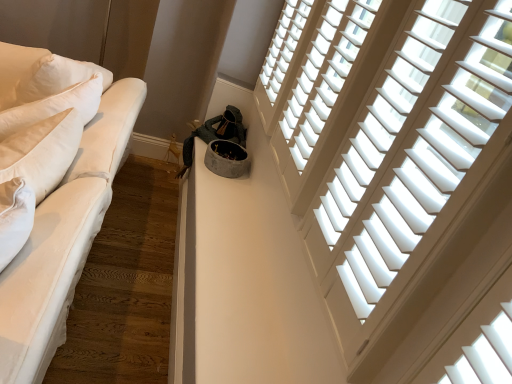
Question: Is white wood blinds at upper right, the third window in the front-to-back sequence, positioned behind white wood blinds at upper right, placed as the second window when sorted from front to back?

Choices:
 (A) no
 (B) yes

Answer: (B)

Question: Is white wood blinds at upper right, the third window in the front-to-back sequence, beside white wood blinds at upper right, placed as the second window when sorted from front to back?

Choices:
 (A) no
 (B) yes

Answer: (A)

Question: From a real-world perspective, is white wood blinds at upper right, positioned as the first window in back-to-front order, positioned over white wood blinds at upper right, placed as the second window when sorted from front to back, based on gravity?

Choices:
 (A) yes
 (B) no

Answer: (B)

Question: Is white wood blinds at upper right, positioned as the first window in back-to-front order, wider than white wood blinds at upper right, the 2th window in the back-to-front sequence?

Choices:
 (A) yes
 (B) no

Answer: (B)

Question: Is white wood blinds at upper right, the third window in the front-to-back sequence, not inside white wood blinds at upper right, the 2th window in the back-to-front sequence?

Choices:
 (A) no
 (B) yes

Answer: (B)

Question: Considering the positions of white wood blinds at upper right, marked as the first window in a front-to-back arrangement, and white wood blinds at upper right, the 2th window in the back-to-front sequence, in the image, is white wood blinds at upper right, marked as the first window in a front-to-back arrangement, wider or thinner than white wood blinds at upper right, the 2th window in the back-to-front sequence,?

Choices:
 (A) wide
 (B) thin

Answer: (A)

Question: Is point (450, 213) positioned closer to the camera than point (337, 67)?

Choices:
 (A) closer
 (B) farther

Answer: (A)

Question: Considering the positions of white wood blinds at upper right, marked as the first window in a front-to-back arrangement, and white wood blinds at upper right, the 2th window in the back-to-front sequence, in the image, is white wood blinds at upper right, marked as the first window in a front-to-back arrangement, bigger or smaller than white wood blinds at upper right, the 2th window in the back-to-front sequence,?

Choices:
 (A) big
 (B) small

Answer: (A)

Question: Is white wood blinds at upper right, arranged as the third window when viewed from the back, inside the boundaries of white wood blinds at upper right, placed as the second window when sorted from front to back, or outside?

Choices:
 (A) outside
 (B) inside

Answer: (A)

Question: Considering their positions, is white cotton studio couch at left located in front of or behind white wood blinds at upper right, marked as the first window in a front-to-back arrangement?

Choices:
 (A) front
 (B) behind

Answer: (A)

Question: From the image's perspective, is white cotton studio couch at left above or below white wood blinds at upper right, arranged as the third window when viewed from the back?

Choices:
 (A) below
 (B) above

Answer: (A)

Question: In terms of width, does white cotton studio couch at left look wider or thinner when compared to white wood blinds at upper right, arranged as the third window when viewed from the back?

Choices:
 (A) wide
 (B) thin

Answer: (A)

Question: Considering the positions of white cotton studio couch at left and white wood blinds at upper right, marked as the first window in a front-to-back arrangement, in the image, is white cotton studio couch at left taller or shorter than white wood blinds at upper right, marked as the first window in a front-to-back arrangement,?

Choices:
 (A) short
 (B) tall

Answer: (A)

Question: Considering their positions, is white wood blinds at upper right, placed as the second window when sorted from front to back, located in front of or behind white cotton studio couch at left?

Choices:
 (A) behind
 (B) front

Answer: (A)

Question: Is white wood blinds at upper right, the 2th window in the back-to-front sequence, bigger or smaller than white cotton studio couch at left?

Choices:
 (A) small
 (B) big

Answer: (A)